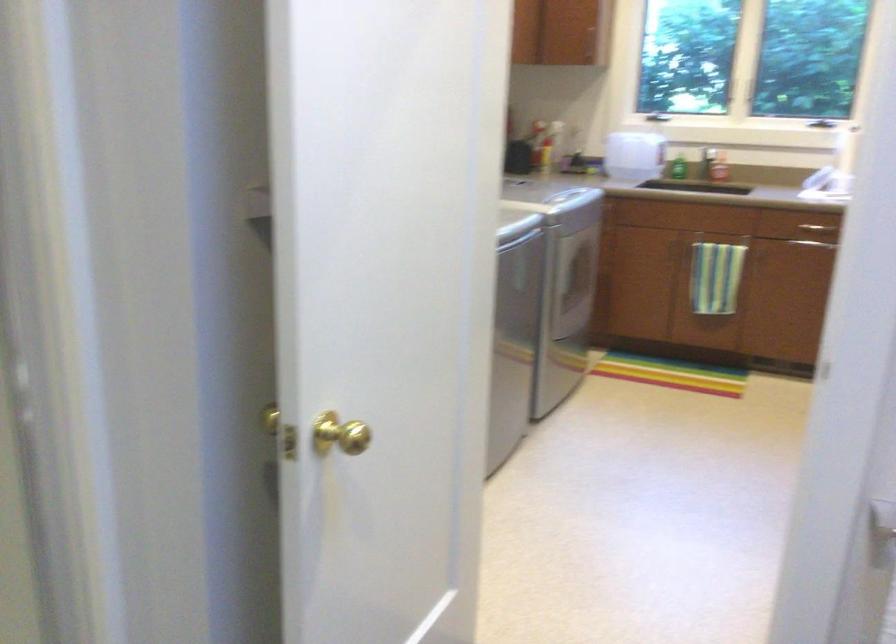
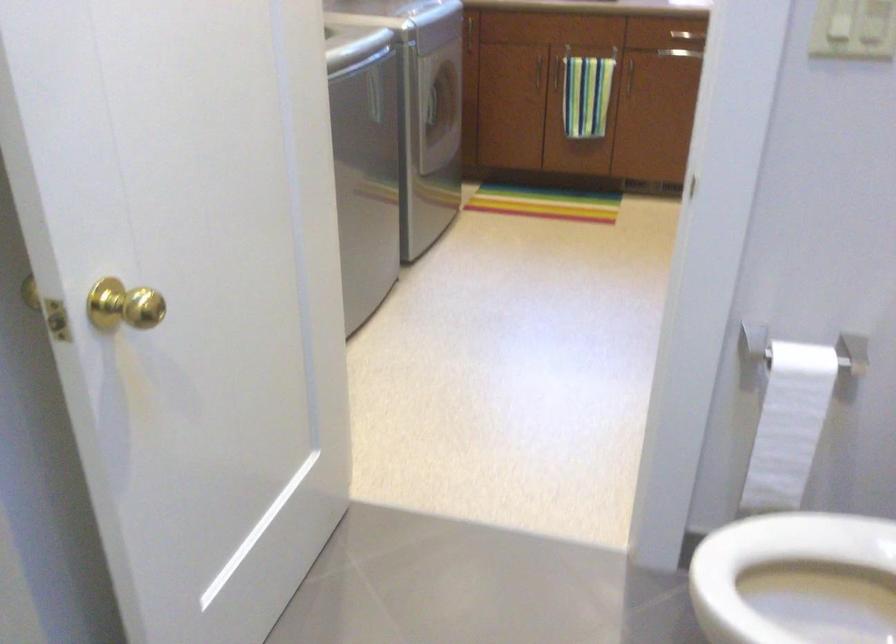
Which direction would the cameraman need to move to produce the second image?

The cameraman walked toward right, forward.